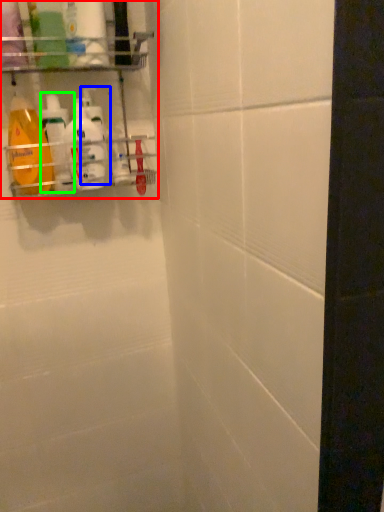
Question: Which is farther away from shelf (highlighted by a red box)? cleaning product (highlighted by a blue box) or cleaning product (highlighted by a green box)?

Choices:
 (A) cleaning product
 (B) cleaning product

Answer: (B)